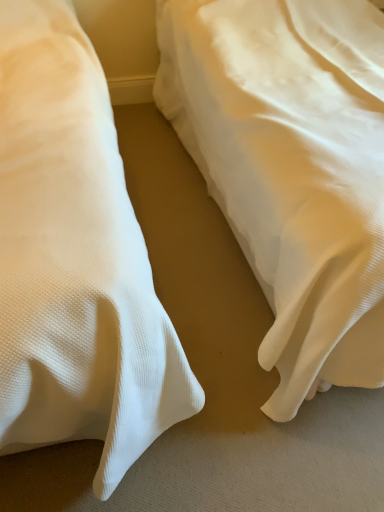
Question: Is white textured bed at right, positioned as the 2th bed in right-to-left order, smaller than white textured bed at center, acting as the second bed starting from the left?

Choices:
 (A) no
 (B) yes

Answer: (B)

Question: Is white textured bed at right, marked as the first bed in a left-to-right arrangement, at the left side of white textured bed at center, the first bed when ordered from right to left?

Choices:
 (A) yes
 (B) no

Answer: (A)

Question: From the image's perspective, would you say white textured bed at right, marked as the first bed in a left-to-right arrangement, is shown under white textured bed at center, acting as the second bed starting from the left?

Choices:
 (A) no
 (B) yes

Answer: (B)

Question: Does white textured bed at right, positioned as the 2th bed in right-to-left order, turn towards white textured bed at center, acting as the second bed starting from the left?

Choices:
 (A) no
 (B) yes

Answer: (A)

Question: Considering the relative sizes of white textured bed at right, positioned as the 2th bed in right-to-left order, and white textured bed at center, acting as the second bed starting from the left, in the image provided, is white textured bed at right, positioned as the 2th bed in right-to-left order, wider than white textured bed at center, acting as the second bed starting from the left,?

Choices:
 (A) yes
 (B) no

Answer: (A)

Question: Is white textured bed at right, positioned as the 2th bed in right-to-left order, further to camera compared to white textured bed at center, acting as the second bed starting from the left?

Choices:
 (A) no
 (B) yes

Answer: (A)

Question: Is white textured bed at center, acting as the second bed starting from the left, smaller than white textured bed at right, marked as the first bed in a left-to-right arrangement?

Choices:
 (A) no
 (B) yes

Answer: (A)

Question: From a real-world perspective, is white textured bed at center, the first bed when ordered from right to left, on top of white textured bed at right, positioned as the 2th bed in right-to-left order?

Choices:
 (A) no
 (B) yes

Answer: (A)

Question: Does white textured bed at center, acting as the second bed starting from the left, lie in front of white textured bed at right, marked as the first bed in a left-to-right arrangement?

Choices:
 (A) no
 (B) yes

Answer: (A)

Question: Is white textured bed at center, the first bed when ordered from right to left, far from white textured bed at right, positioned as the 2th bed in right-to-left order?

Choices:
 (A) yes
 (B) no

Answer: (B)

Question: Is white textured bed at center, acting as the second bed starting from the left, oriented away from white textured bed at right, marked as the first bed in a left-to-right arrangement?

Choices:
 (A) yes
 (B) no

Answer: (B)

Question: Does white textured bed at center, the first bed when ordered from right to left, have a lesser height compared to white textured bed at right, positioned as the 2th bed in right-to-left order?

Choices:
 (A) yes
 (B) no

Answer: (A)

Question: Is white textured bed at right, marked as the first bed in a left-to-right arrangement, taller or shorter than white textured bed at center, the first bed when ordered from right to left?

Choices:
 (A) short
 (B) tall

Answer: (B)